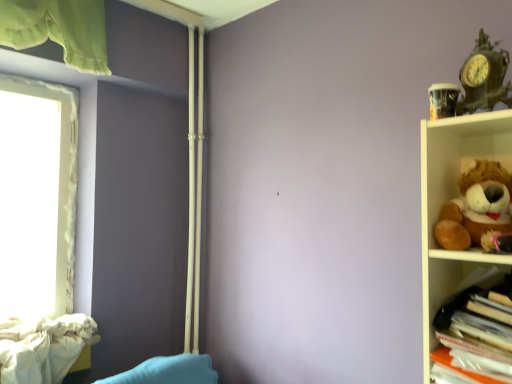
Question: Is white textured curtain at left at the right side of brown plush toy at right, the second toy when ordered from top to bottom?

Choices:
 (A) no
 (B) yes

Answer: (A)

Question: Does white textured curtain at left have a smaller size compared to brown plush toy at right, the second toy when ordered from top to bottom?

Choices:
 (A) no
 (B) yes

Answer: (A)

Question: From the image's perspective, would you say white textured curtain at left is positioned over brown plush toy at right, the second toy when ordered from top to bottom?

Choices:
 (A) yes
 (B) no

Answer: (B)

Question: Is brown plush toy at right, the 1th toy in the bottom-to-top sequence, surrounded by white textured curtain at left?

Choices:
 (A) no
 (B) yes

Answer: (A)

Question: Does white textured curtain at left turn towards brown plush toy at right, the 1th toy in the bottom-to-top sequence?

Choices:
 (A) yes
 (B) no

Answer: (B)

Question: Does point (480, 100) appear closer or farther from the camera than point (73, 150)?

Choices:
 (A) closer
 (B) farther

Answer: (A)

Question: Based on their positions, is antique bronze clock at upper right, the 2th toy ordered from the bottom, located to the left or right of white textured curtain at left?

Choices:
 (A) left
 (B) right

Answer: (B)

Question: From their relative heights in the image, would you say antique bronze clock at upper right, the 2th toy ordered from the bottom, is taller or shorter than white textured curtain at left?

Choices:
 (A) tall
 (B) short

Answer: (B)

Question: Is antique bronze clock at upper right, the first toy from the top, situated inside white textured curtain at left or outside?

Choices:
 (A) outside
 (B) inside

Answer: (A)

Question: In terms of width, does brown plush toy at right, the 1th toy in the bottom-to-top sequence, look wider or thinner when compared to antique bronze clock at upper right, the first toy from the top?

Choices:
 (A) wide
 (B) thin

Answer: (A)

Question: From a real-world perspective, is brown plush toy at right, the second toy when ordered from top to bottom, positioned above or below antique bronze clock at upper right, the first toy from the top?

Choices:
 (A) below
 (B) above

Answer: (A)

Question: Does point (506, 190) appear closer or farther from the camera than point (479, 89)?

Choices:
 (A) closer
 (B) farther

Answer: (A)

Question: Is brown plush toy at right, the 1th toy in the bottom-to-top sequence, in front of or behind antique bronze clock at upper right, the 2th toy ordered from the bottom, in the image?

Choices:
 (A) front
 (B) behind

Answer: (A)

Question: Considering the positions of point (502, 96) and point (457, 213), is point (502, 96) closer or farther from the camera than point (457, 213)?

Choices:
 (A) farther
 (B) closer

Answer: (B)

Question: Considering their positions, is antique bronze clock at upper right, the 2th toy ordered from the bottom, located in front of or behind brown plush toy at right, the second toy when ordered from top to bottom?

Choices:
 (A) behind
 (B) front

Answer: (A)